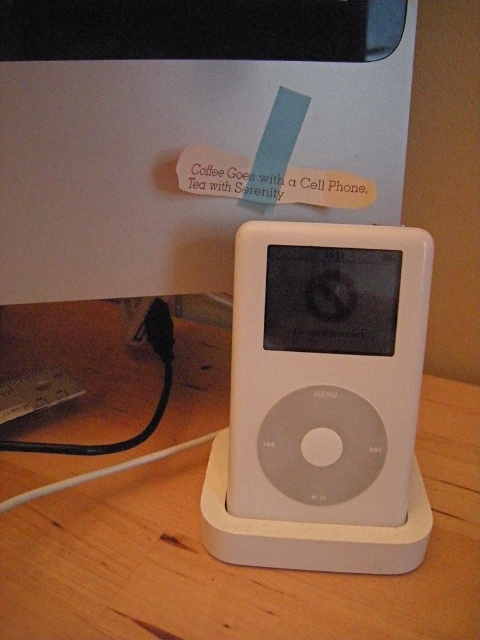
Which is more to the left, wooden table at center or white matte/ipod at center?

wooden table at center is more to the left.

Which is more to the right, wooden table at center or white matte/ipod at center?

From the viewer's perspective, white matte/ipod at center appears more on the right side.

What do you see at coordinates (236, 566) in the screenshot? The height and width of the screenshot is (640, 480). I see `wooden table at center` at bounding box center [236, 566].

Find the location of a particular element. The width and height of the screenshot is (480, 640). wooden table at center is located at coordinates pyautogui.click(x=236, y=566).